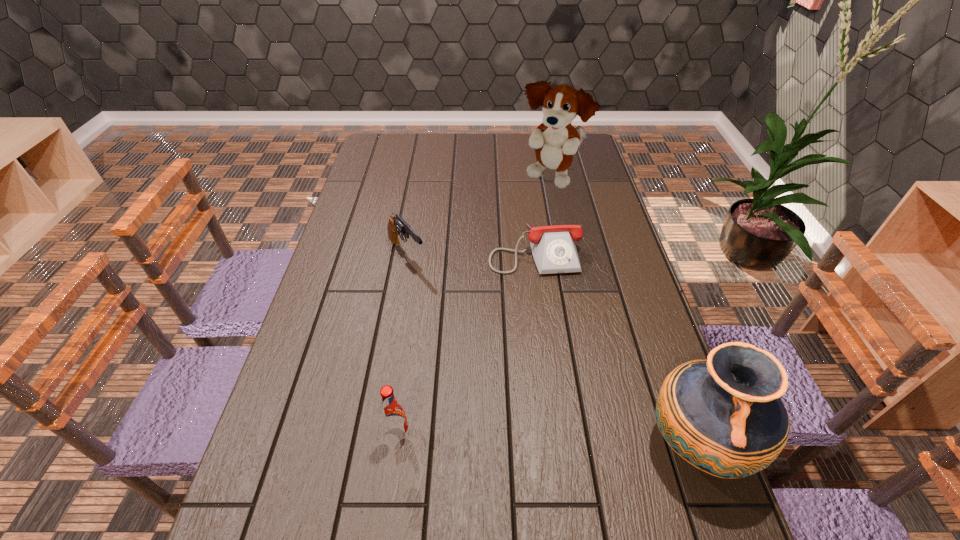
The width and height of the screenshot is (960, 540). Find the location of `free space located on the dial of the shortest object`. free space located on the dial of the shortest object is located at coordinates (556, 334).

Find the location of `free space located 0.220m along the barrel of the gun`. free space located 0.220m along the barrel of the gun is located at coordinates (459, 316).

I want to click on free region located 0.310m along the barrel of the gun, so click(x=478, y=338).

What are the coordinates of `free space located 0.060m along the barrel of the gun` in the screenshot? It's located at (427, 282).

Where is `free space located 0.070m on the face of the farthest object`? This screenshot has height=540, width=960. free space located 0.070m on the face of the farthest object is located at coordinates (545, 208).

Locate an element on the screen. The width and height of the screenshot is (960, 540). free space located 0.050m on the face of the farthest object is located at coordinates (546, 205).

Where is `vacant space located 0.180m on the face of the farthest object`? Image resolution: width=960 pixels, height=540 pixels. vacant space located 0.180m on the face of the farthest object is located at coordinates (541, 227).

I want to click on object present at the near edge, so pyautogui.click(x=724, y=416).

Identify the location of object that is at the left edge. The width and height of the screenshot is (960, 540). (396, 225).

Locate an element on the screen. pottery at the right edge is located at coordinates (724, 416).